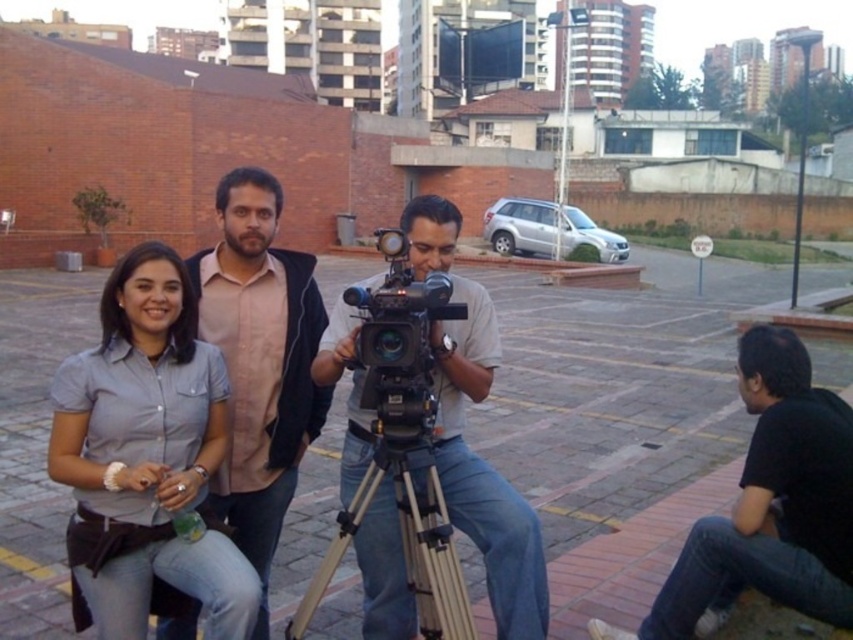
You are a photographer trying to capture a clear shot of the black plastic video camera at center. There is a person wearing a gray matte shirt at center blocking your view. Can you see the camera through the person?

The gray matte shirt at center is larger in size than the black plastic video camera at center, so the person is blocking the view of the camera.

You are a photographer trying to capture a group photo of the people in the scene. You want to ensure that both the black cotton shirt at lower right and the black plastic video camera at center are clearly visible in the photo. Which object should you focus on first to ensure proper depth of field?

The black cotton shirt at lower right is taller than the black plastic video camera at center, so focusing on the black cotton shirt at lower right first will ensure the entire scene is in focus due to its greater height.

You are a photographer standing in the plaza and want to take a picture of the gray matte shirt at center and the black plastic video camera at center. Which object should you focus on first if you want to capture both in sharp focus?

The gray matte shirt at center is closer to the viewer than the black plastic video camera at center. To capture both in sharp focus, you should focus on the gray matte shirt at center first since it is closer, and the depth of field may extend to the farther object.